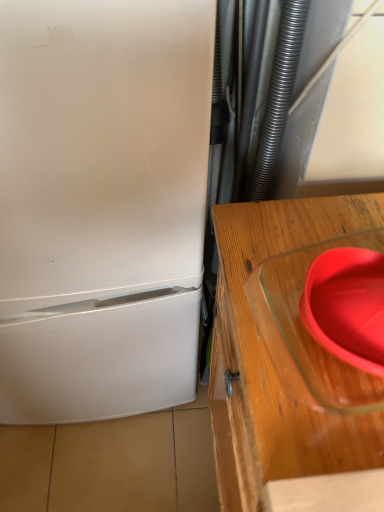
Question: From a real-world perspective, is matte glass bowl at right positioned above or below transparent glass table at right?

Choices:
 (A) below
 (B) above

Answer: (B)

Question: In terms of height, does matte glass bowl at right look taller or shorter compared to transparent glass table at right?

Choices:
 (A) tall
 (B) short

Answer: (B)

Question: Which object is positioned farthest from the transparent glass table at right?

Choices:
 (A) white matte refrigerator at left
 (B) matte glass bowl at right

Answer: (A)

Question: Considering the real-world distances, which object is closest to the white matte refrigerator at left?

Choices:
 (A) transparent glass table at right
 (B) matte glass bowl at right

Answer: (A)